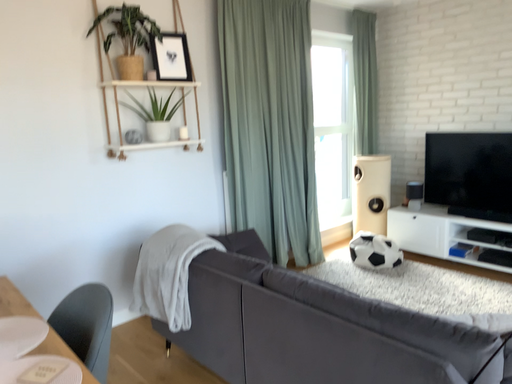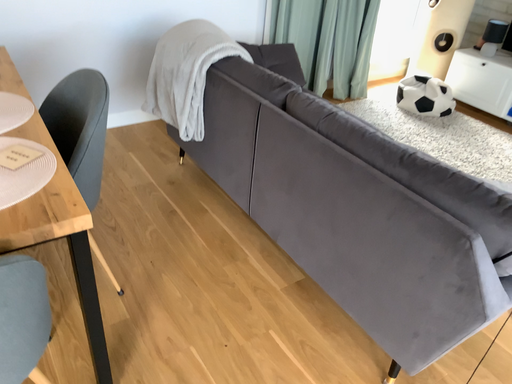
Question: How did the camera likely rotate when shooting the video?

Choices:
 (A) rotated left
 (B) rotated right

Answer: (A)